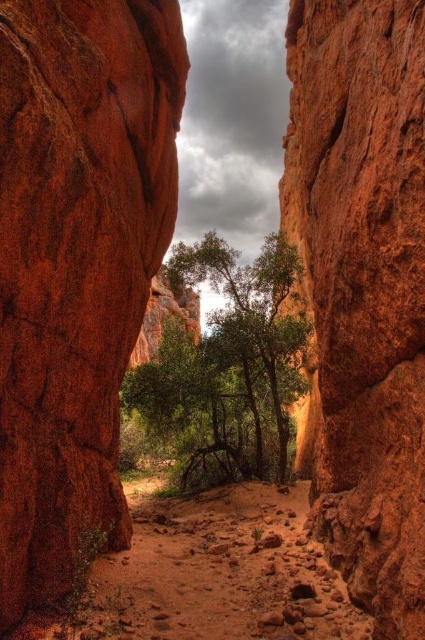
You are a hiker standing at the entrance of the canyon. You notice a rustic sandstone cliff at center and a green leafy tree at center. Which object is taller?

The rustic sandstone cliff at center is taller than the green leafy tree at center according to the description.

You are hiking through the canyon and want to reach the point at the base of the canyon where the green trees and shrubs are located. You are currently standing at point (328, 420). There is another point at (258, 490). Which point should you move towards to get closer to the trees and shrubs?

You should move towards point (258, 490) because point (328, 420) is in front of point (258, 490), meaning point (258, 490) is closer to the base of the canyon where the green trees and shrubs are located.

You are standing at the entrance of the canyon and notice the rustic sandstone cliff at center. Based on its coordinates, can you determine if it is positioned closer to the left or right side of the canyon?

The rustic sandstone cliff at center is located at point 0.453 on the horizontal axis, which places it closer to the left side of the canyon since 0.453 is less than 0.5.